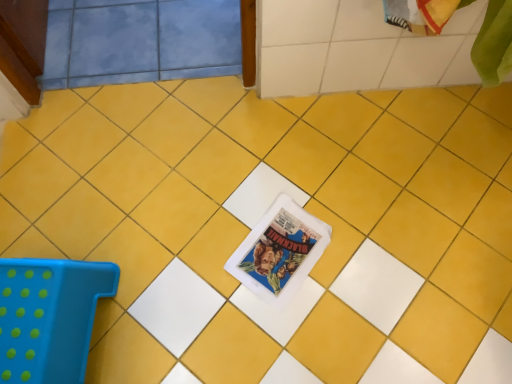
Question: Can you confirm if matte plastic comic book at center is wider than blue plastic stool at lower left?

Choices:
 (A) yes
 (B) no

Answer: (B)

Question: Is matte plastic comic book at center to the left of blue plastic stool at lower left from the viewer's perspective?

Choices:
 (A) yes
 (B) no

Answer: (B)

Question: Can you confirm if matte plastic comic book at center is bigger than blue plastic stool at lower left?

Choices:
 (A) yes
 (B) no

Answer: (B)

Question: Does matte plastic comic book at center contain blue plastic stool at lower left?

Choices:
 (A) yes
 (B) no

Answer: (B)

Question: Can you confirm if matte plastic comic book at center is shorter than blue plastic stool at lower left?

Choices:
 (A) no
 (B) yes

Answer: (B)

Question: Can you see matte plastic comic book at center touching blue plastic stool at lower left?

Choices:
 (A) yes
 (B) no

Answer: (B)

Question: Is blue plastic stool at lower left further to camera compared to matte plastic comic book at center?

Choices:
 (A) yes
 (B) no

Answer: (B)

Question: Is blue plastic stool at lower left positioned before matte plastic comic book at center?

Choices:
 (A) yes
 (B) no

Answer: (A)

Question: Are blue plastic stool at lower left and matte plastic comic book at center beside each other?

Choices:
 (A) yes
 (B) no

Answer: (B)

Question: From the image's perspective, is blue plastic stool at lower left located above matte plastic comic book at center?

Choices:
 (A) yes
 (B) no

Answer: (B)

Question: Is blue plastic stool at lower left not near matte plastic comic book at center?

Choices:
 (A) yes
 (B) no

Answer: (B)

Question: Does blue plastic stool at lower left have a greater width compared to matte plastic comic book at center?

Choices:
 (A) yes
 (B) no

Answer: (A)

Question: Considering the relative positions of matte plastic comic book at center and blue plastic stool at lower left in the image provided, is matte plastic comic book at center to the left or to the right of blue plastic stool at lower left?

Choices:
 (A) left
 (B) right

Answer: (B)